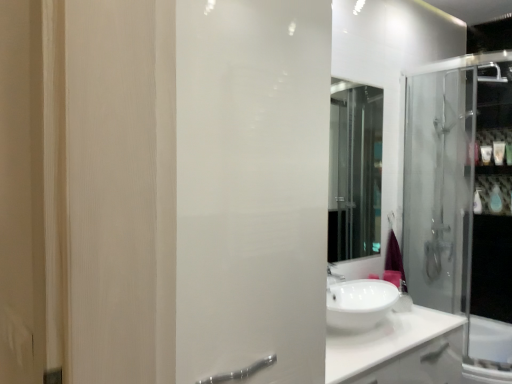
Question: Considering the relative sizes of white glossy bottle at upper right, the first toiletry when ordered from top to bottom, and white frosted glass screen door at center in the image provided, is white glossy bottle at upper right, the first toiletry when ordered from top to bottom, smaller than white frosted glass screen door at center?

Choices:
 (A) no
 (B) yes

Answer: (B)

Question: Can you confirm if white glossy bottle at upper right, the first toiletry when ordered from top to bottom, is bigger than white frosted glass screen door at center?

Choices:
 (A) yes
 (B) no

Answer: (B)

Question: Is white glossy bottle at upper right, the 5th toiletry when ordered from bottom to top, positioned with its back to white frosted glass screen door at center?

Choices:
 (A) yes
 (B) no

Answer: (B)

Question: Is white glossy bottle at upper right, the 5th toiletry when ordered from bottom to top, wider than white frosted glass screen door at center?

Choices:
 (A) yes
 (B) no

Answer: (B)

Question: Does white glossy bottle at upper right, the first toiletry when ordered from top to bottom, appear on the right side of white frosted glass screen door at center?

Choices:
 (A) yes
 (B) no

Answer: (A)

Question: Considering the relative positions of white glossy bottle at right, marked as the fifth toiletry in a top-to-bottom arrangement, and white glossy soap at upper right, which ranks as the third toiletry in top-to-bottom order, in the image provided, is white glossy bottle at right, marked as the fifth toiletry in a top-to-bottom arrangement, to the left or to the right of white glossy soap at upper right, which ranks as the third toiletry in top-to-bottom order,?

Choices:
 (A) right
 (B) left

Answer: (B)

Question: Choose the correct answer: Is white glossy bottle at right, which ranks as the first toiletry in bottom-to-top order, inside white glossy soap at upper right, acting as the 3th toiletry starting from the bottom, or outside it?

Choices:
 (A) inside
 (B) outside

Answer: (B)

Question: Based on their sizes in the image, would you say white glossy bottle at right, marked as the fifth toiletry in a top-to-bottom arrangement, is bigger or smaller than white glossy soap at upper right, which ranks as the third toiletry in top-to-bottom order?

Choices:
 (A) big
 (B) small

Answer: (A)

Question: Considering the positions of point (476, 193) and point (480, 152), is point (476, 193) closer or farther from the camera than point (480, 152)?

Choices:
 (A) farther
 (B) closer

Answer: (A)

Question: Would you say transparent glass shower door at right is to the left or to the right of white glossy soap at upper right, acting as the 3th toiletry starting from the bottom, in the picture?

Choices:
 (A) left
 (B) right

Answer: (A)

Question: From their relative heights in the image, would you say transparent glass shower door at right is taller or shorter than white glossy soap at upper right, acting as the 3th toiletry starting from the bottom?

Choices:
 (A) tall
 (B) short

Answer: (A)

Question: In terms of width, does transparent glass shower door at right look wider or thinner when compared to white glossy soap at upper right, acting as the 3th toiletry starting from the bottom?

Choices:
 (A) thin
 (B) wide

Answer: (B)

Question: From a real-world perspective, is transparent glass shower door at right above or below white glossy soap at upper right, acting as the 3th toiletry starting from the bottom?

Choices:
 (A) below
 (B) above

Answer: (A)

Question: In terms of height, does transparent glass shower door at right look taller or shorter compared to white glossy counter top at center?

Choices:
 (A) short
 (B) tall

Answer: (B)

Question: Visually, is transparent glass shower door at right positioned to the left or to the right of white glossy counter top at center?

Choices:
 (A) right
 (B) left

Answer: (A)